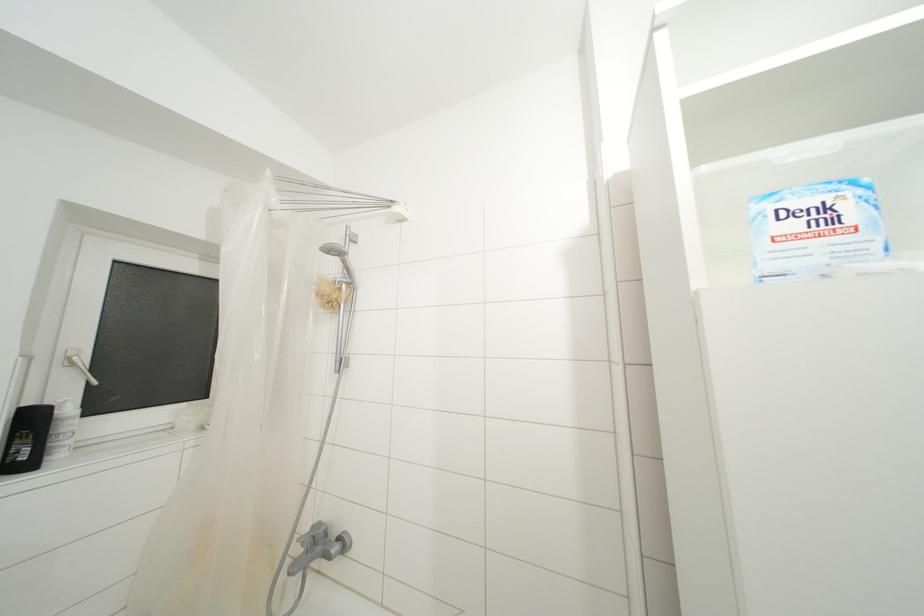
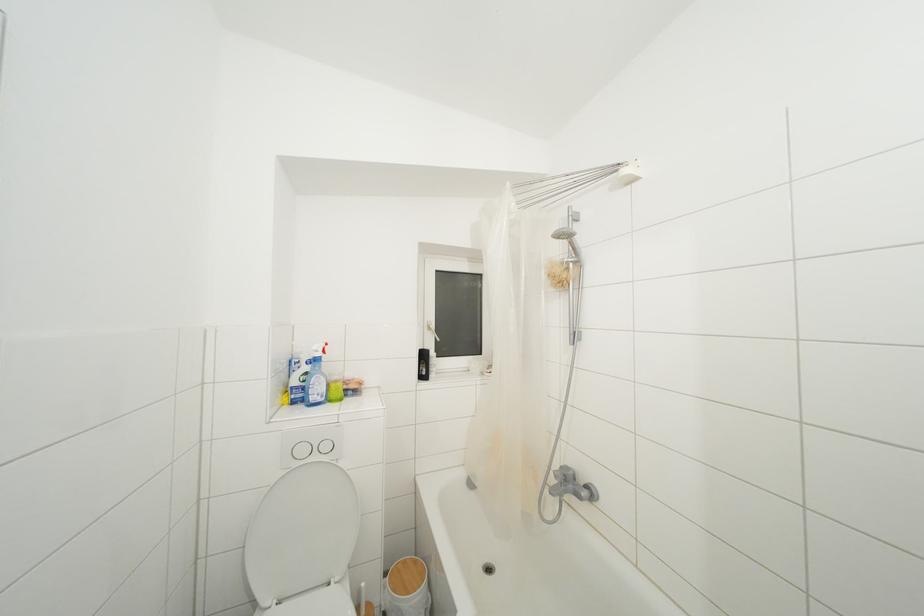
Locate, in the second image, the point that corresponds to point (351, 274) in the first image.

(578, 254)